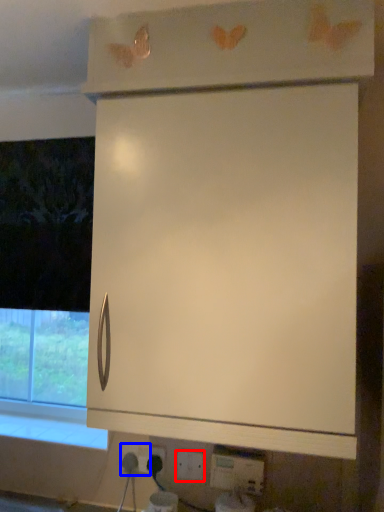
Question: Which object is closer to the camera taking this photo, electric outlet (highlighted by a red box) or electric outlet (highlighted by a blue box)?

Choices:
 (A) electric outlet
 (B) electric outlet

Answer: (A)